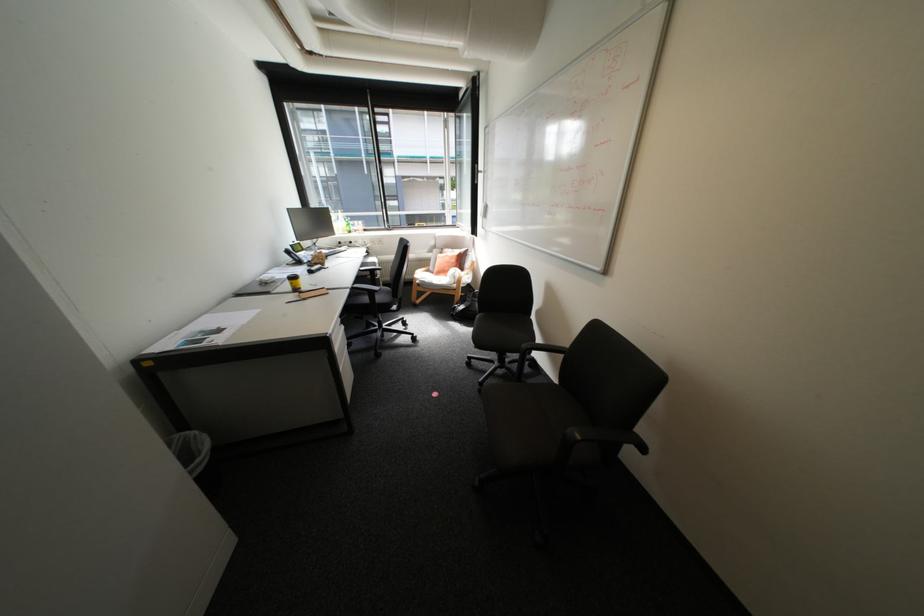
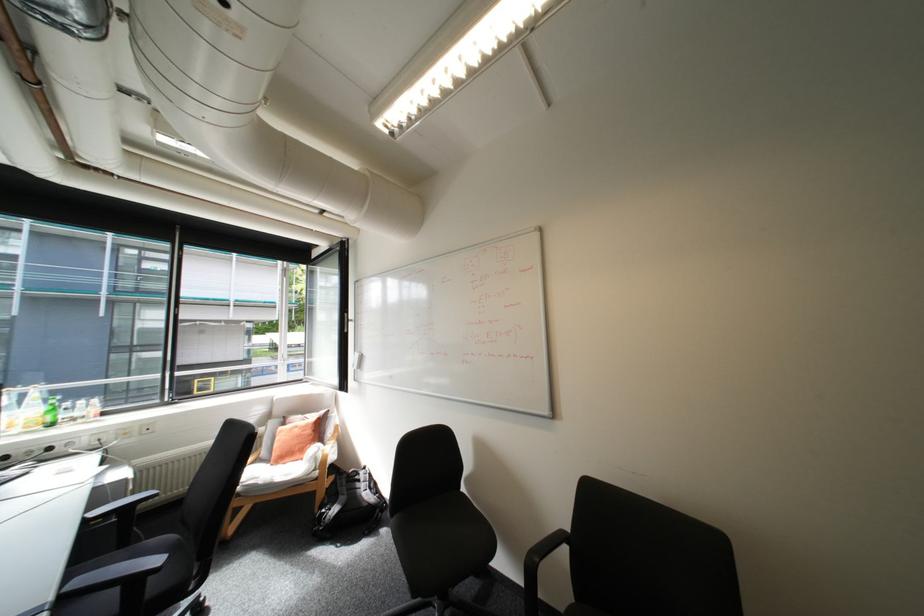
In the second image, find the point that corresponds to [468,306] in the first image.

(339, 509)